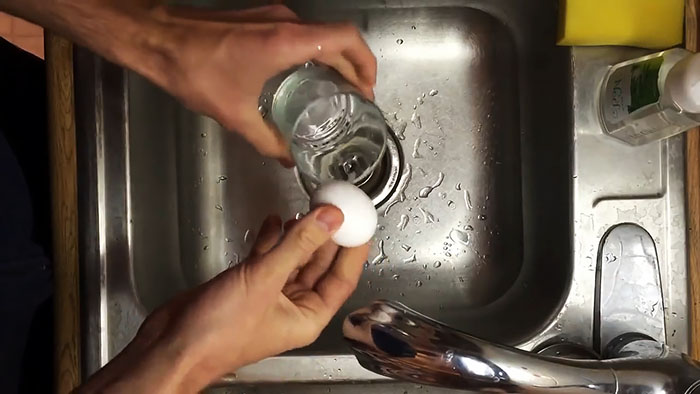
The width and height of the screenshot is (700, 394). What are the coordinates of `sink` in the screenshot? It's located at (444, 193).